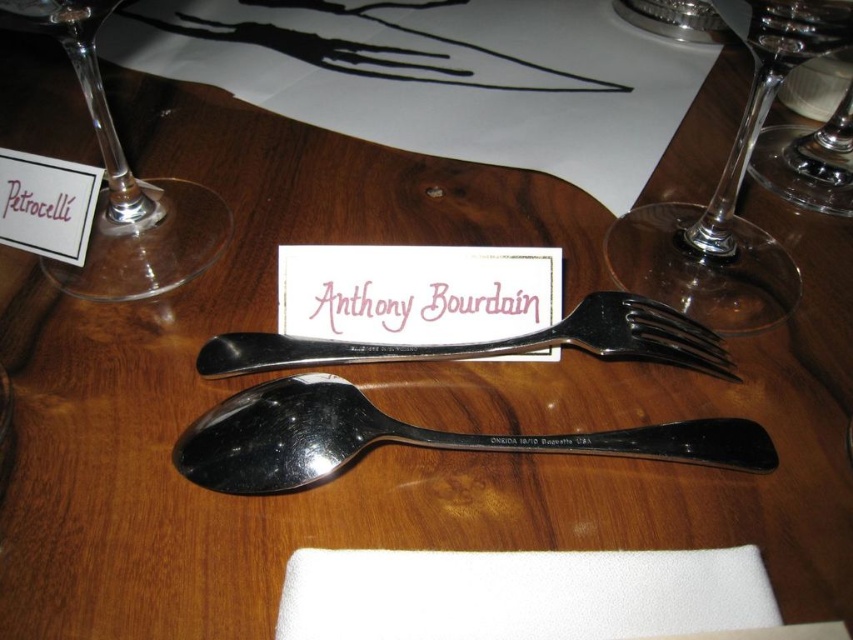
Is pink paper name card at center further to the viewer compared to clear glass wine glass at upper right?

Yes, it is behind clear glass wine glass at upper right.

Between point (500, 337) and point (834, 170), which one is positioned in front?

Point (500, 337) is in front.

Find the location of a particular element. pink paper name card at center is located at coordinates (422, 308).

Can you confirm if white fabric napkin at center is wider than clear glass wine glass at left?

Indeed, white fabric napkin at center has a greater width compared to clear glass wine glass at left.

Is point (437, 580) positioned behind point (65, 275)?

That is False.

Locate an element on the screen. The image size is (853, 640). white fabric napkin at center is located at coordinates (521, 593).

Where is `white fabric napkin at center`? The height and width of the screenshot is (640, 853). white fabric napkin at center is located at coordinates (521, 593).

Which is more to the right, polished silver spoon at center or clear glass wine glass at left?

From the viewer's perspective, polished silver spoon at center appears more on the right side.

Which is below, polished silver spoon at center or clear glass wine glass at left?

Positioned lower is polished silver spoon at center.

Which is in front, point (196, 472) or point (100, 92)?

Point (196, 472) is more forward.

Identify the location of polished silver spoon at center. This screenshot has width=853, height=640. (405, 438).